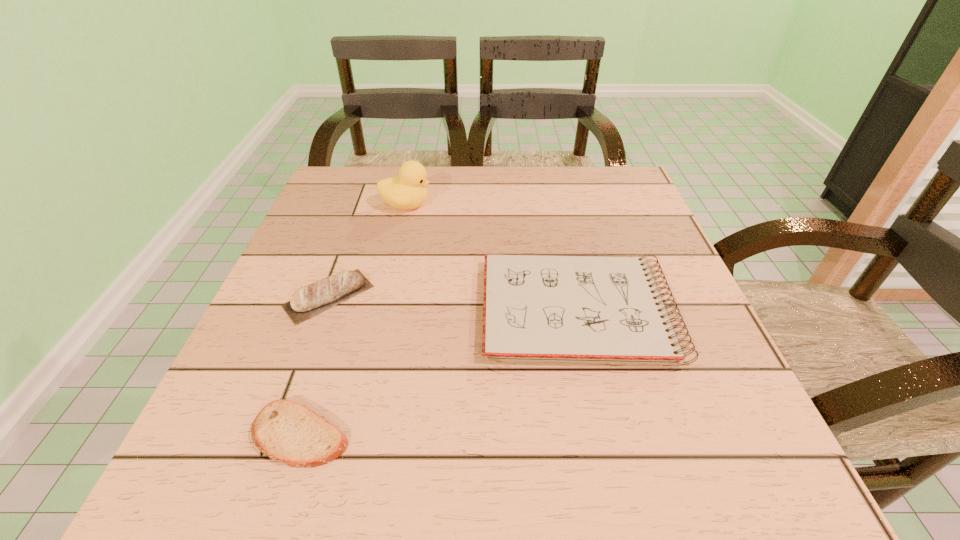
You are a GUI agent. You are given a task and a screenshot of the screen. Output one action in this format:
    pyautogui.click(x=<x>, y=<y>)
    Task: Click on the object that is at the far edge
    
    Given the screenshot: What is the action you would take?
    pyautogui.click(x=407, y=191)

Locate an element on the screen. This screenshot has height=540, width=960. object that is at the near edge is located at coordinates (287, 432).

Identify the location of duck that is at the left edge. This screenshot has height=540, width=960. (407, 191).

The image size is (960, 540). Find the location of `object located in the right edge section of the desktop`. object located in the right edge section of the desktop is located at coordinates (548, 308).

Locate an element on the screen. This screenshot has width=960, height=540. object positioned at the far left corner is located at coordinates (407, 191).

What are the coordinates of `object located at the near left corner` in the screenshot? It's located at (287, 432).

You are a GUI agent. You are given a task and a screenshot of the screen. Output one action in this format:
    pyautogui.click(x=<x>, y=<y>)
    Task: Click on the vacant area at the far edge
    
    Given the screenshot: What is the action you would take?
    pyautogui.click(x=496, y=206)

Where is `free space at the near edge of the desktop`? The height and width of the screenshot is (540, 960). free space at the near edge of the desktop is located at coordinates 542,456.

I want to click on vacant region at the left edge of the desktop, so click(x=342, y=224).

Image resolution: width=960 pixels, height=540 pixels. Identify the location of vacant space at the right edge of the desktop. (700, 369).